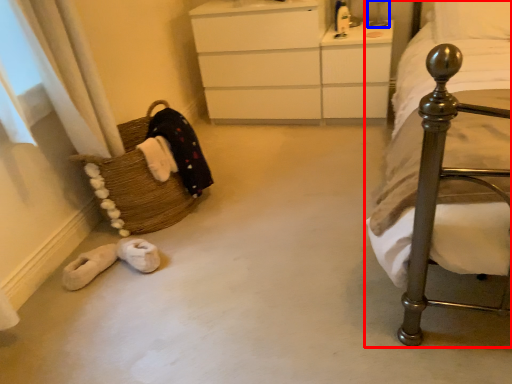
Question: Which of the following is the farthest to the observer, bed (highlighted by a red box) or table lamp (highlighted by a blue box)?

Choices:
 (A) bed
 (B) table lamp

Answer: (B)